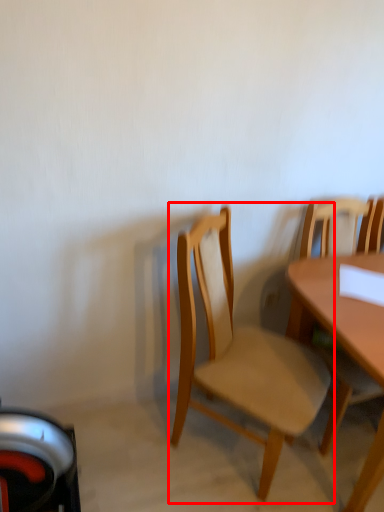
Question: From the image's perspective, where is chair (annotated by the red box) located in relation to chair in the image?

Choices:
 (A) below
 (B) above

Answer: (A)